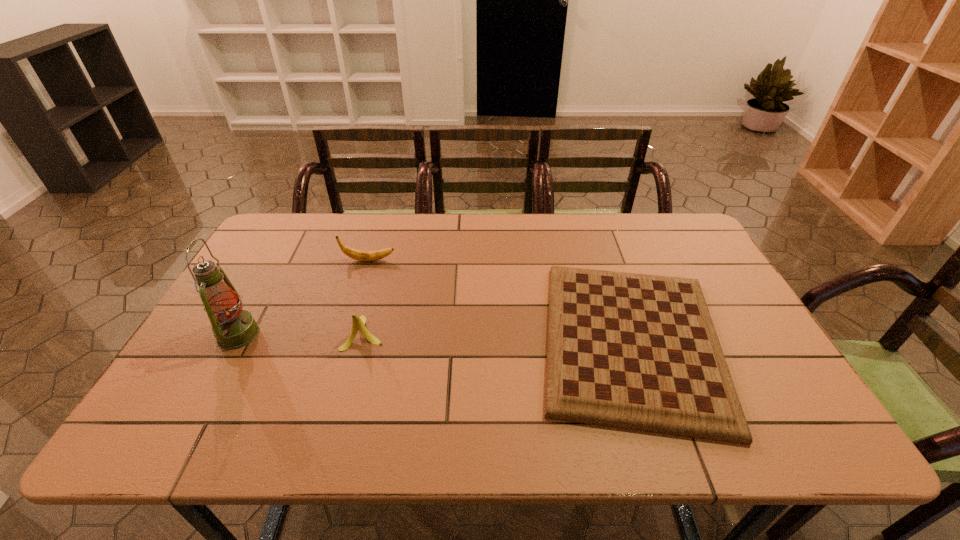
This screenshot has height=540, width=960. What are the coordinates of `oil lamp` in the screenshot? It's located at (233, 328).

The image size is (960, 540). In order to click on the leftmost object in this screenshot , I will do `click(233, 328)`.

What are the coordinates of `the nearer banana` in the screenshot? It's located at (358, 322).

Find the location of a particular element. the farthest object is located at coordinates (355, 254).

Identify the location of the shortest object. Image resolution: width=960 pixels, height=540 pixels. (635, 351).

Find the location of a particular element. The width and height of the screenshot is (960, 540). gameboard is located at coordinates click(x=635, y=351).

The width and height of the screenshot is (960, 540). In order to click on vacant space located 0.390m on the back of the leftmost object in this screenshot , I will do `click(294, 233)`.

I want to click on free space located on the left of the nearer banana, so click(237, 333).

Locate an element on the screen. Image resolution: width=960 pixels, height=540 pixels. free spot located on the peel of the farthest object from the top is located at coordinates (434, 260).

Find the location of a particular element. The image size is (960, 540). blank space located 0.200m on the left of the gameboard is located at coordinates (457, 341).